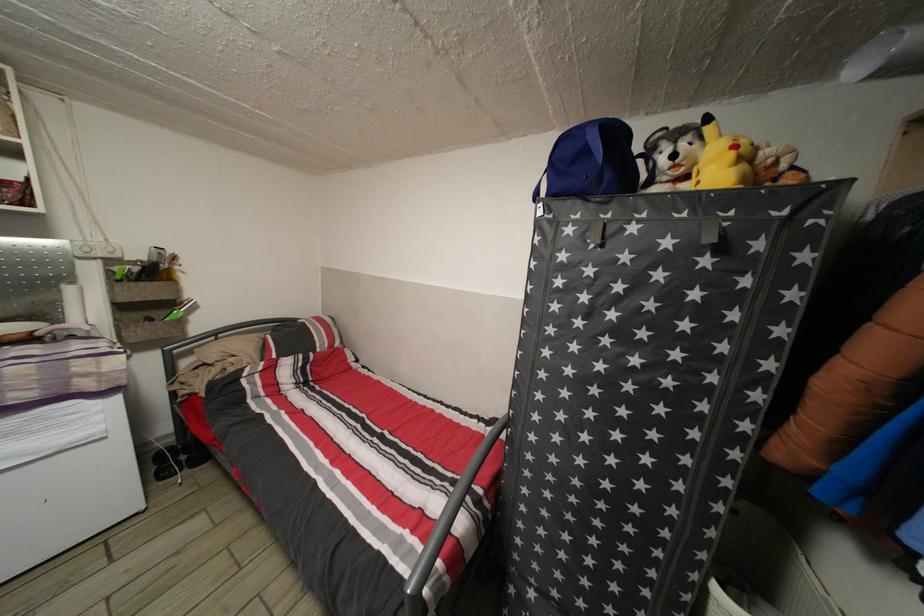
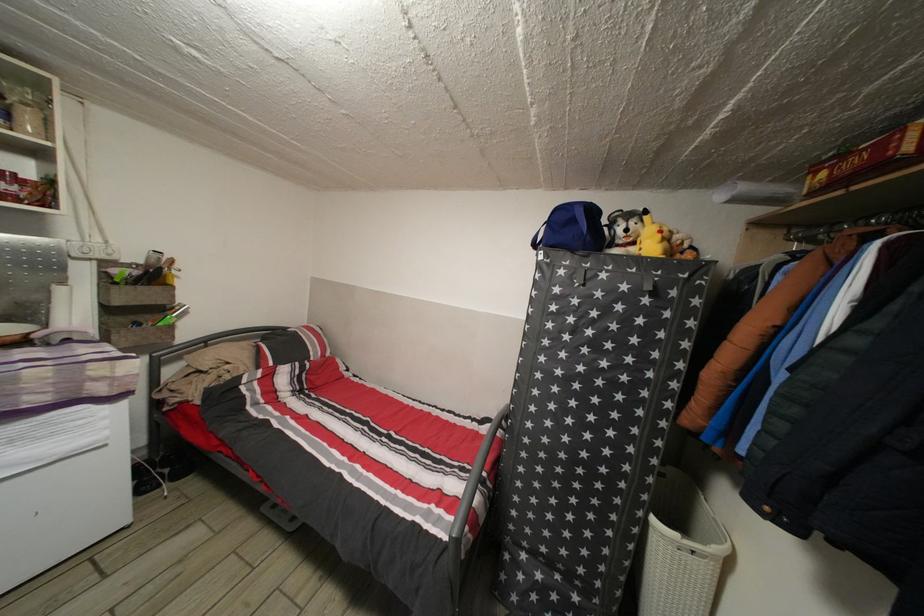
In a continuous first-person perspective shot, in which direction is the camera moving?

The cameraman walked toward left, backward.